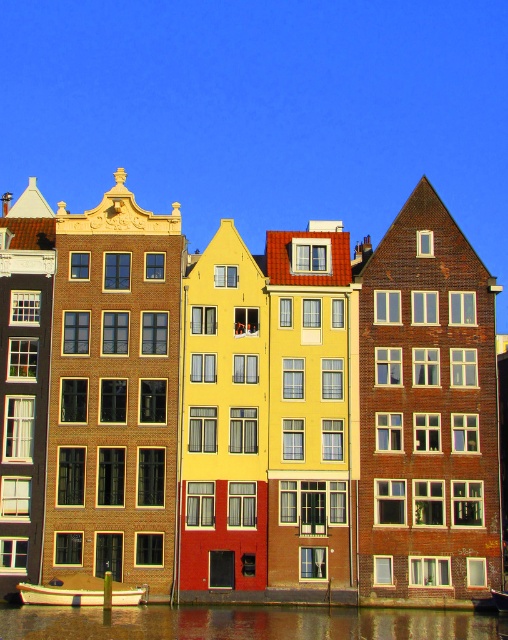
Question: Which point appears closest to the camera in this image?

Choices:
 (A) (36, 620)
 (B) (61, 577)

Answer: (A)

Question: Is smooth reflective water at lower center thinner than white glossy boat at lower left?

Choices:
 (A) yes
 (B) no

Answer: (B)

Question: Where is smooth reflective water at lower center located in relation to white glossy boat at lower left in the image?

Choices:
 (A) above
 (B) below

Answer: (B)

Question: Which object appears farthest from the camera in this image?

Choices:
 (A) smooth reflective water at lower center
 (B) white glossy boat at lower left

Answer: (B)

Question: In this image, where is smooth reflective water at lower center located relative to white glossy boat at lower left?

Choices:
 (A) below
 (B) above

Answer: (A)